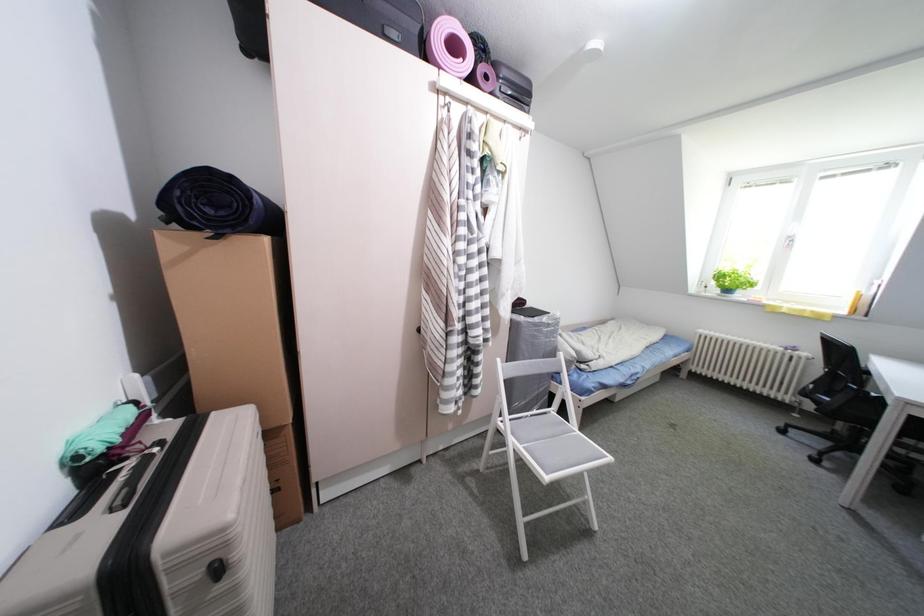
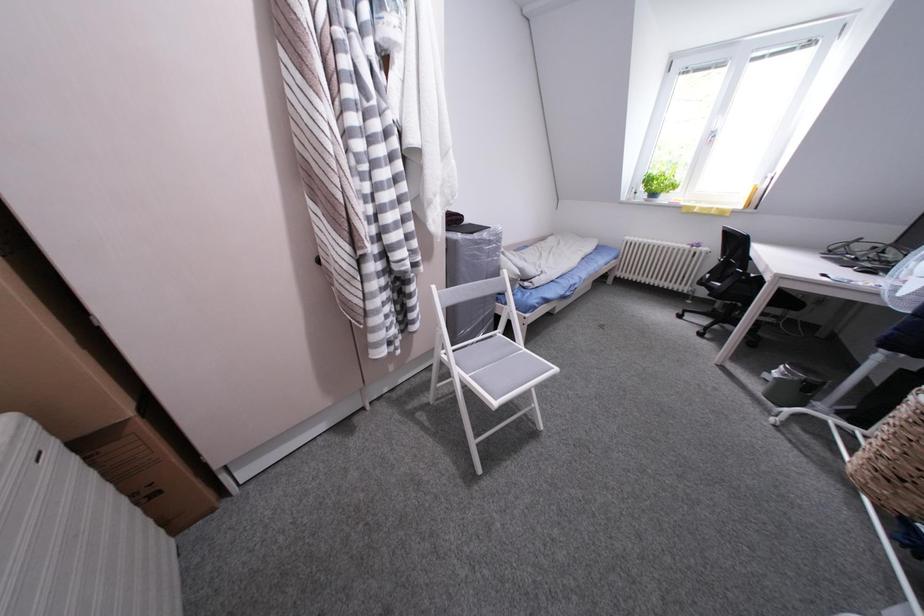
In a continuous first-person perspective shot, in which direction is the camera moving?

The cameraman moved toward right, forward.